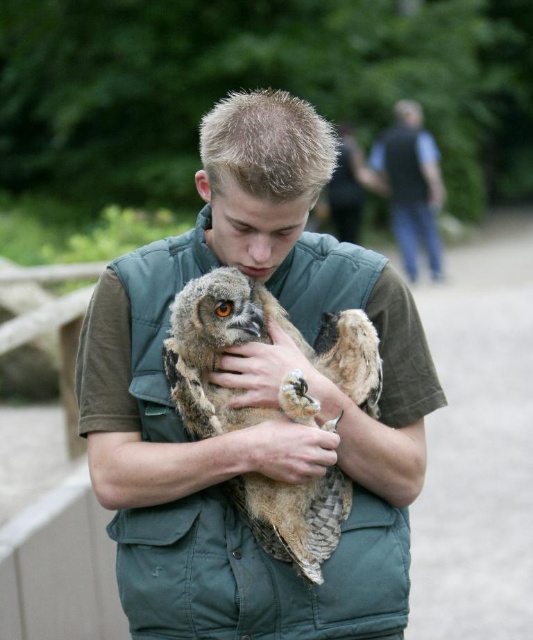
You are a zoo visitor trying to locate the zookeeper. You see the green fabric vest at center and the dark gray vest at upper right. Which zookeeper is shorter?

The green fabric vest at center is shorter than the dark gray vest at upper right, so the zookeeper wearing the green fabric vest at center is the shorter one.

You are a zoo visitor observing the two owls in the image. Which owl, the brown feathered owl at center or the brown textured owl at center, is positioned to the right side?

The brown feathered owl at center is positioned to the right of the brown textured owl at center, so the brown feathered owl at center is the one on the right side.